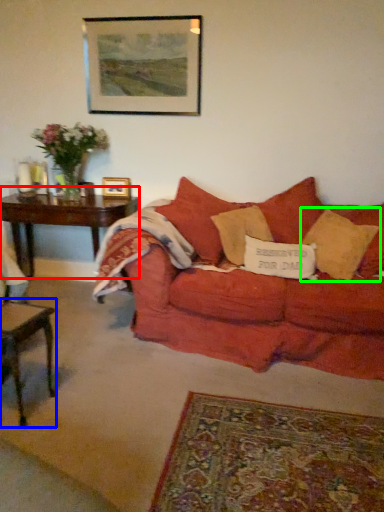
Question: Which object is the closest to the table (highlighted by a red box)? Choose among these: table (highlighted by a blue box) or pillow (highlighted by a green box).

Choices:
 (A) table
 (B) pillow

Answer: (A)